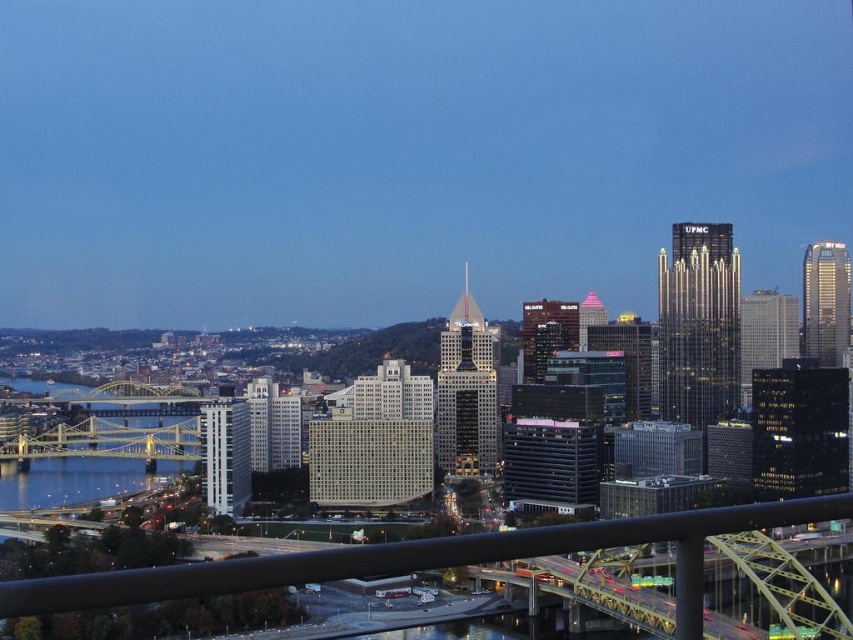
Does yellow metallic bridge at left have a smaller size compared to blue glassy water at lower left?

No.

Does yellow metallic bridge at left appear on the right side of blue glassy water at lower left?

Indeed, yellow metallic bridge at left is positioned on the right side of blue glassy water at lower left.

The height and width of the screenshot is (640, 853). I want to click on yellow metallic bridge at left, so click(x=115, y=426).

Who is more distant from viewer, (306, 563) or (109, 403)?

Positioned behind is point (109, 403).

Measure the distance between black matte rail at lower center and yellow metallic bridge at left.

black matte rail at lower center and yellow metallic bridge at left are 78.74 meters apart.

Is point (351, 566) less distant than point (148, 428)?

Yes, point (351, 566) is in front of point (148, 428).

Where is `black matte rail at lower center`? black matte rail at lower center is located at coordinates (397, 556).

The height and width of the screenshot is (640, 853). What do you see at coordinates (397, 556) in the screenshot?
I see `black matte rail at lower center` at bounding box center [397, 556].

Does point (583, 529) lie behind point (19, 493)?

No.

This screenshot has width=853, height=640. In order to click on black matte rail at lower center in this screenshot , I will do `click(397, 556)`.